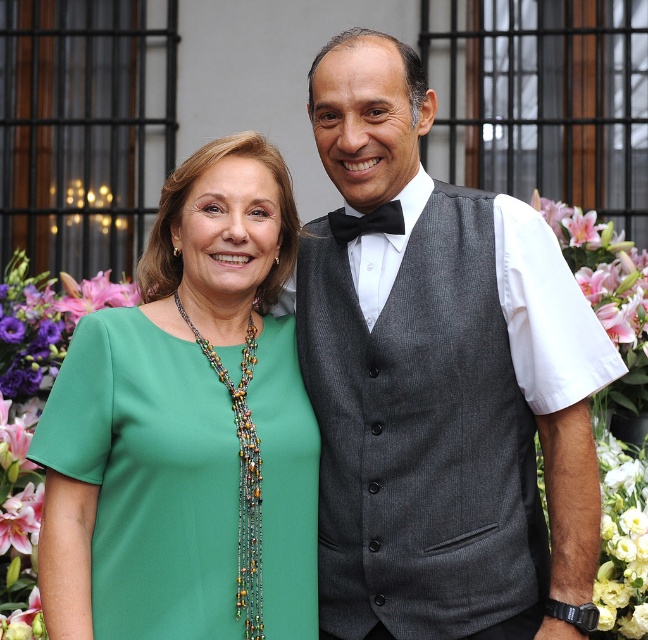
Based on the photo, does green satin blouse at center appear on the left side of pink silk flower at right?

Indeed, green satin blouse at center is positioned on the left side of pink silk flower at right.

The height and width of the screenshot is (640, 648). Find the location of `green satin blouse at center`. green satin blouse at center is located at coordinates (183, 424).

Is point (443, 307) less distant than point (25, 541)?

Yes, point (443, 307) is in front of point (25, 541).

Is point (410, 81) positioned after point (29, 362)?

No, (410, 81) is closer to viewer.

Is point (430, 632) positioned after point (40, 291)?

That is False.

The image size is (648, 640). I want to click on matte gray vest at center, so click(x=441, y=381).

Is point (579, 323) closer to viewer compared to point (612, 381)?

No.

At what (x,y) coordinates should I click in order to perform the action: click on matte gray vest at center. Please return your answer as a coordinate pair (x, y). The height and width of the screenshot is (640, 648). Looking at the image, I should click on (441, 381).

Where is `matte gray vest at center`? matte gray vest at center is located at coordinates [441, 381].